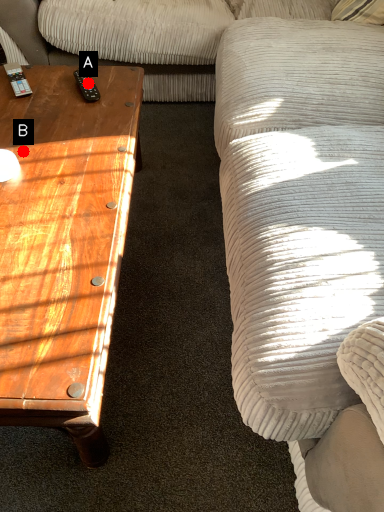
Question: Two points are circled on the image, labeled by A and B beside each circle. Which point is farther to the camera?

Choices:
 (A) A is further
 (B) B is further

Answer: (A)